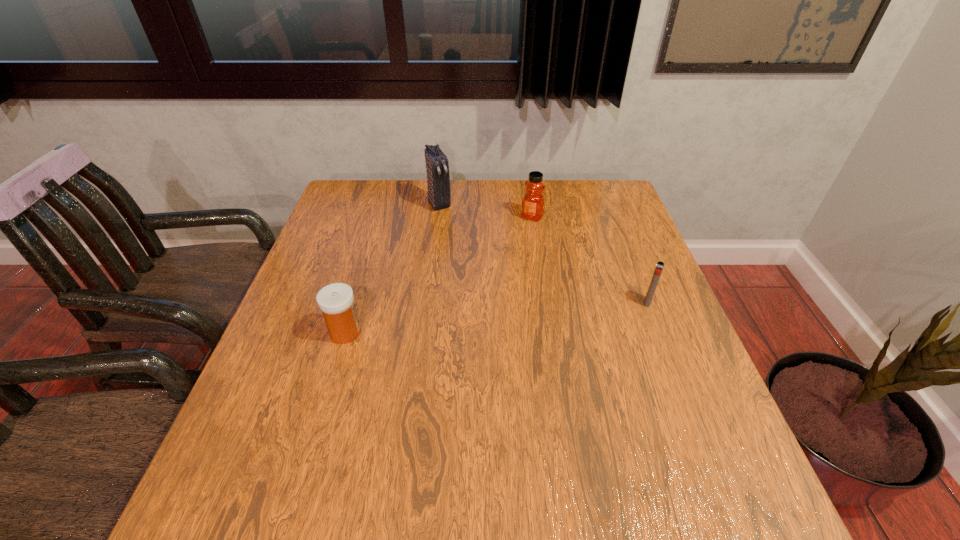
You are a GUI agent. You are given a task and a screenshot of the screen. Output one action in this format:
    pyautogui.click(x=<x>, y=<y>)
    Task: Click on the free spot on the desktop that is between the leftmost object and the third farthest object and is positioned with the zip open on the clutch bag
    
    Given the screenshot: What is the action you would take?
    pos(513,316)

Where is `vacant space on the desktop that is between the leftmost object and the third farthest object and is positioned on the front label of the second tallest object`? vacant space on the desktop that is between the leftmost object and the third farthest object and is positioned on the front label of the second tallest object is located at coordinates (458, 321).